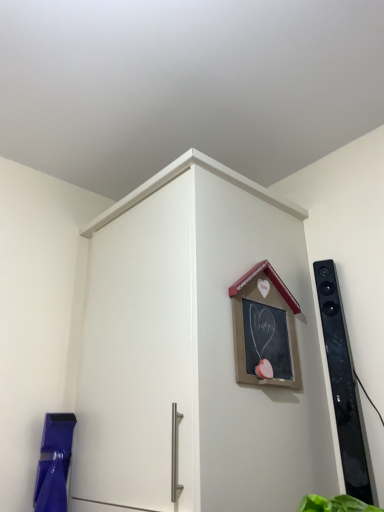
What is the approximate width of white matte cabinet at center?

white matte cabinet at center is 24.70 inches wide.

What do you see at coordinates (196, 352) in the screenshot? The width and height of the screenshot is (384, 512). I see `white matte cabinet at center` at bounding box center [196, 352].

At what (x,y) coordinates should I click in order to perform the action: click on white matte cabinet at center. Please return your answer as a coordinate pair (x, y). Looking at the image, I should click on (196, 352).

Where is `white matte cabinet at center`? The width and height of the screenshot is (384, 512). white matte cabinet at center is located at coordinates (196, 352).